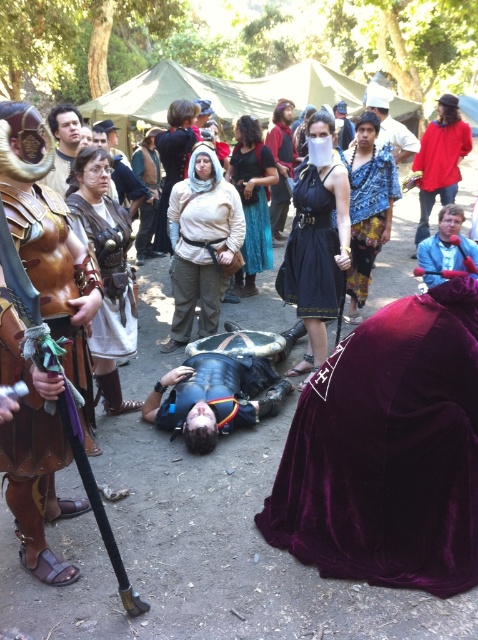
The height and width of the screenshot is (640, 478). Describe the element at coordinates (388, 451) in the screenshot. I see `velvet maroon cape at lower right` at that location.

Based on the photo, is velvet maroon cape at lower right below velvet skirt at center?

Indeed, velvet maroon cape at lower right is positioned under velvet skirt at center.

This screenshot has height=640, width=478. What are the coordinates of `velvet maroon cape at lower right` in the screenshot? It's located at (388, 451).

Does point (305, 291) come farther from viewer compared to point (456, 250)?

No, it is not.

Between velvet black dress at center and blue fabric jacket at upper right, which one is positioned higher?

blue fabric jacket at upper right

The image size is (478, 640). What do you see at coordinates (312, 250) in the screenshot?
I see `velvet black dress at center` at bounding box center [312, 250].

You are a GUI agent. You are given a task and a screenshot of the screen. Output one action in this format:
    pyautogui.click(x=<x>, y=<y>)
    Task: Click on the velvet black dress at center
    Image resolution: width=478 pixels, height=640 pixels.
    Given the screenshot: What is the action you would take?
    pyautogui.click(x=312, y=250)

Is leather armor at left wider than velvet skirt at center?

Yes, leather armor at left is wider than velvet skirt at center.

Which is in front, point (30, 552) or point (250, 260)?

Point (30, 552)

Locate an element on the screen. Image resolution: width=478 pixels, height=640 pixels. leather armor at left is located at coordinates (49, 243).

Find the location of `leather armor at left`. leather armor at left is located at coordinates (49, 243).